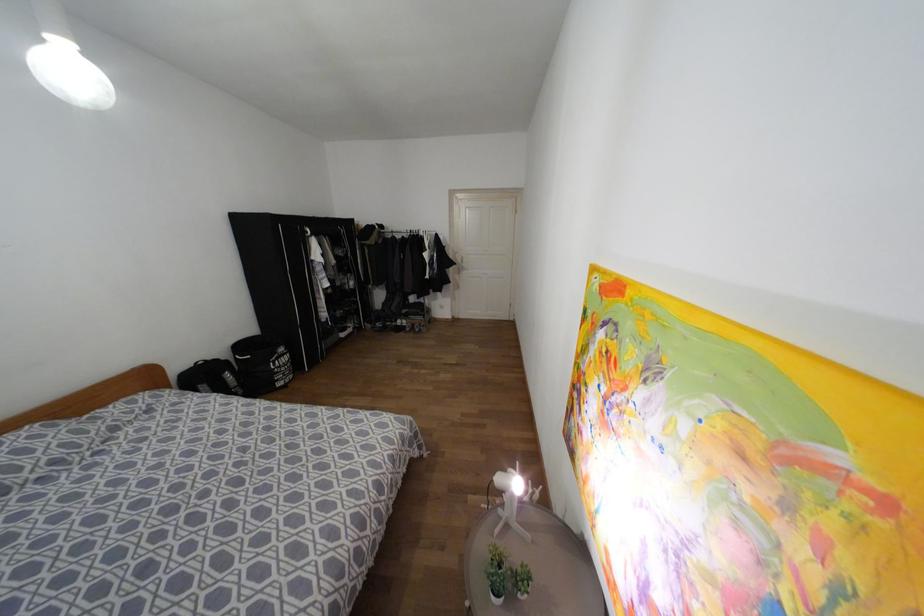
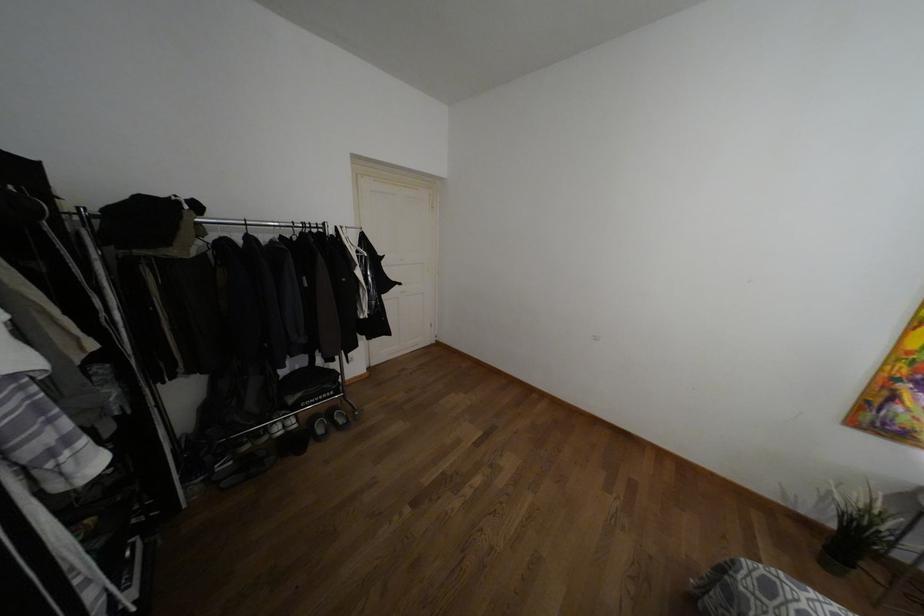
The point at (x=387, y=323) is marked in the first image. Where is the corresponding point in the second image?

(246, 447)